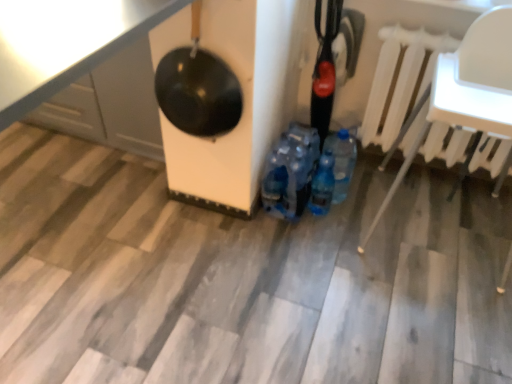
Locate an element on the screen. This screenshot has width=512, height=384. vacant point to the right of blue translucent bottle at center is located at coordinates (354, 215).